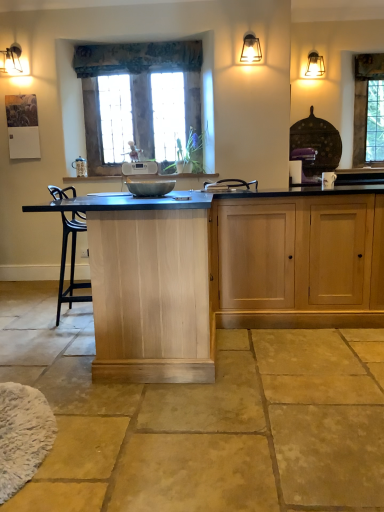
The height and width of the screenshot is (512, 384). In order to click on vacant space to the right of white fluffy mat at lower left in this screenshot , I will do `click(127, 439)`.